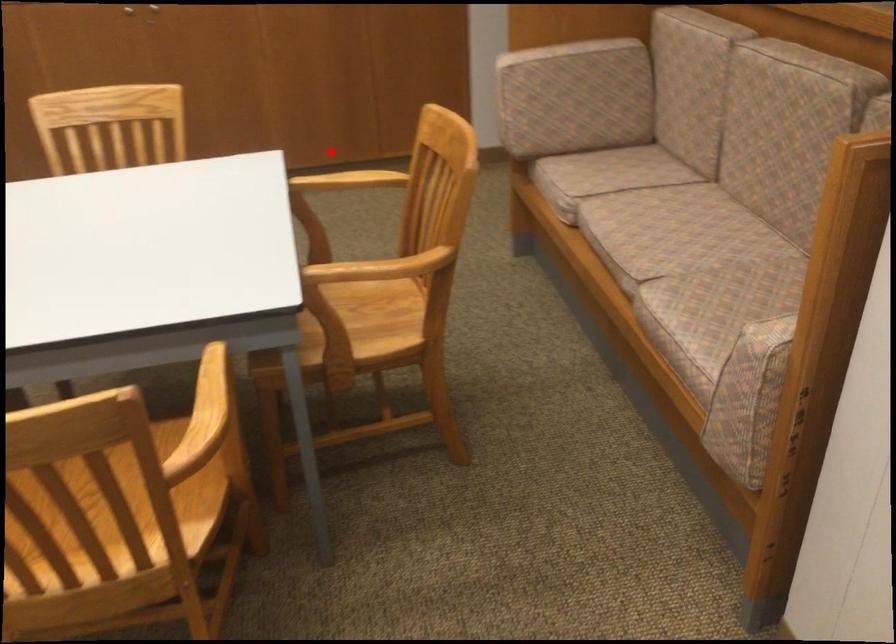
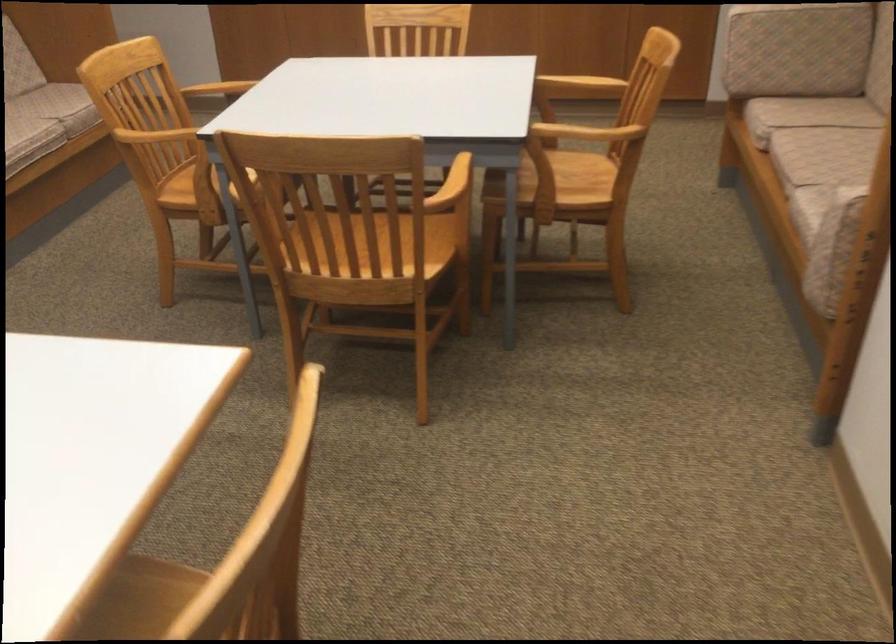
The point at the highlighted location is marked in the first image. Where is the corresponding point in the second image?

(580, 84)